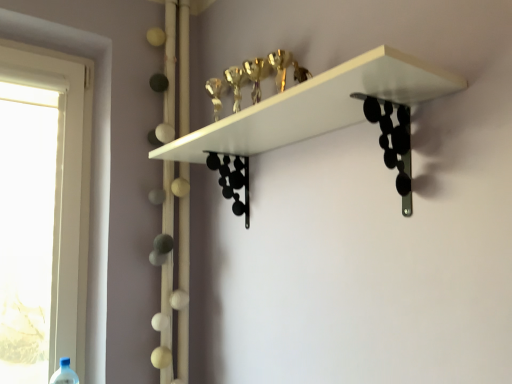
What do you see at coordinates (316, 106) in the screenshot?
I see `white matte shelf at upper center` at bounding box center [316, 106].

This screenshot has height=384, width=512. I want to click on white matte shelf at upper center, so click(x=316, y=106).

This screenshot has height=384, width=512. What do you see at coordinates (64, 373) in the screenshot?
I see `blue plastic bottle at lower left` at bounding box center [64, 373].

What is the approximate width of blue plastic bottle at lower left?

blue plastic bottle at lower left is 4.31 inches wide.

Measure the distance between point (57,377) and camera.

Point (57,377) is 1.48 meters from camera.

Image resolution: width=512 pixels, height=384 pixels. Find the location of `blue plastic bottle at lower left`. blue plastic bottle at lower left is located at coordinates (64, 373).

What is the approximate height of blue plastic bottle at lower left?

The height of blue plastic bottle at lower left is 13.27 inches.

Identify the location of white matte shelf at upper center. The image size is (512, 384). (316, 106).

Does white matte shelf at upper center appear on the right side of blue plastic bottle at lower left?

Correct, you'll find white matte shelf at upper center to the right of blue plastic bottle at lower left.

Is white matte shelf at upper center closer to camera compared to blue plastic bottle at lower left?

Yes, white matte shelf at upper center is closer to the camera.

Between point (394, 59) and point (70, 374), which one is positioned behind?

The point (70, 374) is farther.

From the image's perspective, is white matte shelf at upper center on top of blue plastic bottle at lower left?

Yes.

From a real-world perspective, is white matte shelf at upper center positioned above or below blue plastic bottle at lower left?

white matte shelf at upper center is above blue plastic bottle at lower left.

Consider the image. Which object is wider, white matte shelf at upper center or blue plastic bottle at lower left?

Wider between the two is white matte shelf at upper center.

Does white matte shelf at upper center have a greater height compared to blue plastic bottle at lower left?

In fact, white matte shelf at upper center may be shorter than blue plastic bottle at lower left.

Is white matte shelf at upper center bigger or smaller than blue plastic bottle at lower left?

Considering their sizes, white matte shelf at upper center takes up more space than blue plastic bottle at lower left.

Is blue plastic bottle at lower left inside white matte shelf at upper center?

No, blue plastic bottle at lower left is not a part of white matte shelf at upper center.

Would you consider white matte shelf at upper center to be distant from blue plastic bottle at lower left?

Absolutely, white matte shelf at upper center is distant from blue plastic bottle at lower left.

Is white matte shelf at upper center positioned with its back to blue plastic bottle at lower left?

That's not correct — white matte shelf at upper center is not looking away from blue plastic bottle at lower left.

How many degrees apart are the facing directions of white matte shelf at upper center and blue plastic bottle at lower left?

There is a 92.8-degree angle between the facing directions of white matte shelf at upper center and blue plastic bottle at lower left.

This screenshot has width=512, height=384. Identify the location of wine bottle on the left of the white matte shelf at upper center. (64, 373).

Considering the positions of objects blue plastic bottle at lower left and white matte shelf at upper center in the image provided, who is more to the left, blue plastic bottle at lower left or white matte shelf at upper center?

blue plastic bottle at lower left is more to the left.

Considering the relative positions of blue plastic bottle at lower left and white matte shelf at upper center in the image provided, is blue plastic bottle at lower left in front of white matte shelf at upper center?

No, it is behind white matte shelf at upper center.

Which is in front, point (55, 373) or point (288, 112)?

The point (288, 112) is closer to the camera.

From the image's perspective, between blue plastic bottle at lower left and white matte shelf at upper center, who is located below?

blue plastic bottle at lower left, from the image's perspective.

From a real-world perspective, who is located lower, blue plastic bottle at lower left or white matte shelf at upper center?

From a 3D spatial view, blue plastic bottle at lower left is below.

Considering the relative sizes of blue plastic bottle at lower left and white matte shelf at upper center in the image provided, is blue plastic bottle at lower left wider than white matte shelf at upper center?

No, blue plastic bottle at lower left is not wider than white matte shelf at upper center.

Considering the sizes of objects blue plastic bottle at lower left and white matte shelf at upper center in the image provided, who is shorter, blue plastic bottle at lower left or white matte shelf at upper center?

white matte shelf at upper center is shorter.

Considering the relative sizes of blue plastic bottle at lower left and white matte shelf at upper center in the image provided, is blue plastic bottle at lower left smaller than white matte shelf at upper center?

Indeed, blue plastic bottle at lower left has a smaller size compared to white matte shelf at upper center.

Would you say blue plastic bottle at lower left is inside or outside white matte shelf at upper center?

blue plastic bottle at lower left lies outside white matte shelf at upper center.

Are blue plastic bottle at lower left and white matte shelf at upper center making contact?

No, blue plastic bottle at lower left is not beside white matte shelf at upper center.

Is blue plastic bottle at lower left looking in the opposite direction of white matte shelf at upper center?

No, blue plastic bottle at lower left is not facing the opposite direction of white matte shelf at upper center.

How far apart are blue plastic bottle at lower left and white matte shelf at upper center?

They are 1.12 meters apart.

You are a GUI agent. You are given a task and a screenshot of the screen. Output one action in this format:
    pyautogui.click(x=<x>, y=<y>)
    Task: Click on the wine bottle that appears on the left of white matte shelf at upper center
    Image resolution: width=512 pixels, height=384 pixels.
    Given the screenshot: What is the action you would take?
    pyautogui.click(x=64, y=373)

Identify the location of wine bottle lying below the white matte shelf at upper center (from the image's perspective). The height and width of the screenshot is (384, 512). (64, 373).

I want to click on wine bottle below the white matte shelf at upper center (from a real-world perspective), so click(x=64, y=373).